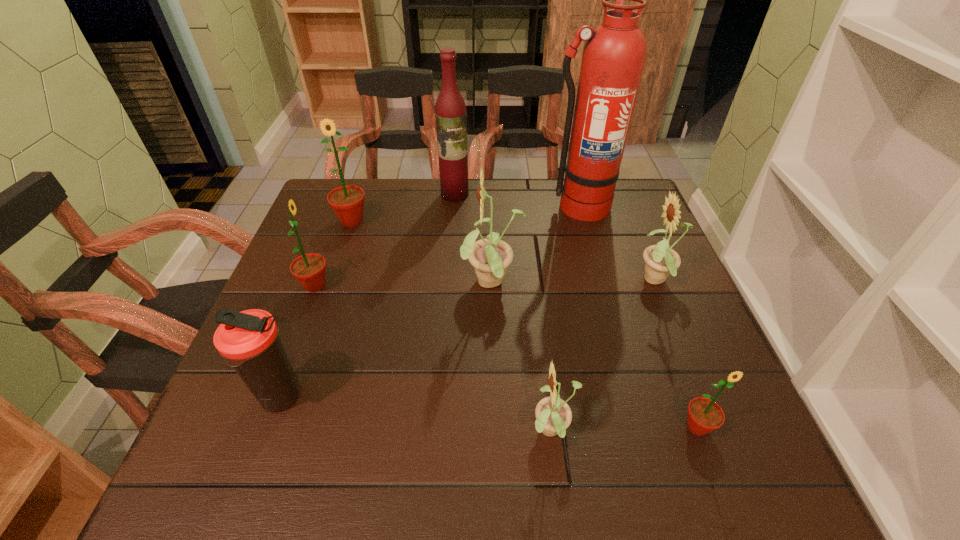
Point out which sunflower is positioned as the fourth nearest to the eighth shortest object. Please provide its 2D coordinates. Your answer should be formatted as a tuple, i.e. [(x, y)], where the tuple contains the x and y coordinates of a point satisfying the conditions above.

[(660, 260)]

Find the location of a particular element. This screenshot has height=540, width=960. yellow sunflower identified as the third closest to the tallest object is located at coordinates (553, 415).

Where is `yellow sunflower identified as the second closest to the rightmost yellow sunflower`? This screenshot has width=960, height=540. yellow sunflower identified as the second closest to the rightmost yellow sunflower is located at coordinates (553, 415).

The width and height of the screenshot is (960, 540). In order to click on green sunflower that is the closest to the biggest green sunflower in this screenshot , I will do `click(309, 269)`.

Locate an element on the screen. This screenshot has height=540, width=960. green sunflower that is the third closest to the smallest yellow sunflower is located at coordinates (347, 202).

You are a GUI agent. You are given a task and a screenshot of the screen. Output one action in this format:
    pyautogui.click(x=<x>, y=<y>)
    Task: Click on the free location that satisfies the following two spatial constraints: 1. on the label side of the fire extinguisher; 2. on the front-facing side of the nearest yellow sunflower
    
    Given the screenshot: What is the action you would take?
    pyautogui.click(x=640, y=432)